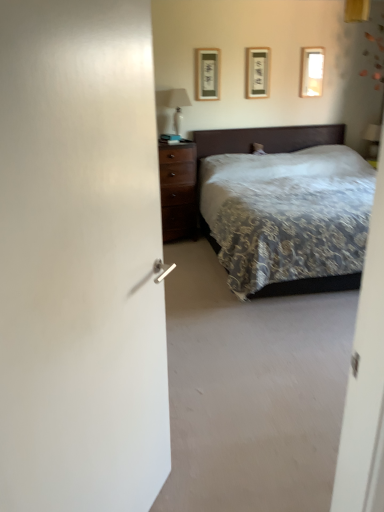
Question: Is the position of matte white plastic table lamp at upper right, which is the 2th table lamp in front-to-back order, more distant than that of matte wooden picture frame at upper center, which appears as the second picture frame when viewed from the left?

Choices:
 (A) yes
 (B) no

Answer: (A)

Question: Is matte white plastic table lamp at upper right, acting as the 1th table lamp starting from the right, bigger than matte wooden picture frame at upper center, which appears as the second picture frame when viewed from the left?

Choices:
 (A) no
 (B) yes

Answer: (B)

Question: Considering the relative sizes of matte white plastic table lamp at upper right, which is the 2th table lamp in front-to-back order, and matte wooden picture frame at upper center, which appears as the second picture frame when viewed from the left, in the image provided, is matte white plastic table lamp at upper right, which is the 2th table lamp in front-to-back order, taller than matte wooden picture frame at upper center, which appears as the second picture frame when viewed from the left,?

Choices:
 (A) no
 (B) yes

Answer: (A)

Question: Is matte white plastic table lamp at upper right, acting as the 1th table lamp starting from the right, oriented away from matte wooden picture frame at upper center, which appears as the second picture frame when viewed from the left?

Choices:
 (A) no
 (B) yes

Answer: (A)

Question: Is the depth of matte white plastic table lamp at upper right, which is the 2th table lamp in front-to-back order, less than that of matte wooden picture frame at upper center, the second picture frame viewed from the right?

Choices:
 (A) no
 (B) yes

Answer: (A)

Question: Can you confirm if matte white plastic table lamp at upper right, acting as the 1th table lamp starting from the right, is positioned to the left of matte wooden picture frame at upper center, the second picture frame viewed from the right?

Choices:
 (A) yes
 (B) no

Answer: (B)

Question: From the image's perspective, is matte black picture frame at upper center, which appears as the 3th picture frame when viewed from the right, on top of matte wooden picture frame at upper center, the second picture frame viewed from the right?

Choices:
 (A) no
 (B) yes

Answer: (A)

Question: Is matte black picture frame at upper center, which appears as the 3th picture frame when viewed from the right, wider than matte wooden picture frame at upper center, the second picture frame viewed from the right?

Choices:
 (A) no
 (B) yes

Answer: (B)

Question: Does matte black picture frame at upper center, arranged as the first picture frame when viewed from the left, have a lesser height compared to matte wooden picture frame at upper center, which appears as the second picture frame when viewed from the left?

Choices:
 (A) yes
 (B) no

Answer: (B)

Question: Is matte black picture frame at upper center, arranged as the first picture frame when viewed from the left, not within matte wooden picture frame at upper center, which appears as the second picture frame when viewed from the left?

Choices:
 (A) no
 (B) yes

Answer: (B)

Question: Is matte black picture frame at upper center, arranged as the first picture frame when viewed from the left, bigger than matte wooden picture frame at upper center, which appears as the second picture frame when viewed from the left?

Choices:
 (A) yes
 (B) no

Answer: (A)

Question: Does matte black picture frame at upper center, which appears as the 3th picture frame when viewed from the right, turn towards matte wooden picture frame at upper center, the second picture frame viewed from the right?

Choices:
 (A) no
 (B) yes

Answer: (A)

Question: From a real-world perspective, is matte white plastic table lamp at upper right, acting as the 1th table lamp starting from the right, located beneath white glossy table lamp at upper center, marked as the 1th table lamp in a left-to-right arrangement?

Choices:
 (A) no
 (B) yes

Answer: (B)